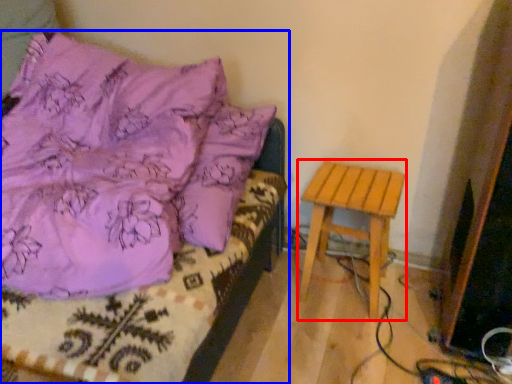
Question: Among these objects, which one is nearest to the camera, stool (highlighted by a red box) or furniture (highlighted by a blue box)?

Choices:
 (A) stool
 (B) furniture

Answer: (B)